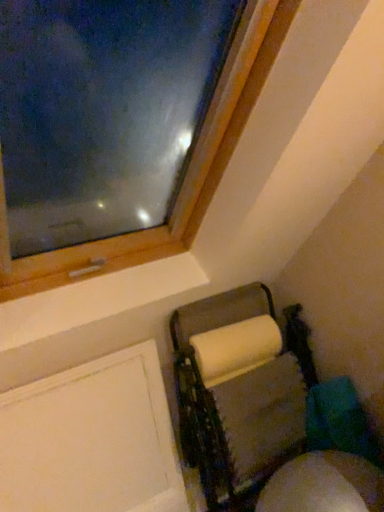
Describe the element at coordinates (256, 396) in the screenshot. The image size is (384, 512). I see `white cardboard paper towel holder at lower right` at that location.

The width and height of the screenshot is (384, 512). What are the coordinates of `white cardboard paper towel holder at lower right` in the screenshot? It's located at (256, 396).

What is the approximate width of white cardboard paper towel holder at lower right?

11.61 inches.

Describe the element at coordinates (92, 440) in the screenshot. The height and width of the screenshot is (512, 384). I see `white matte screen door at lower left` at that location.

Identify the location of white matte screen door at lower left. The height and width of the screenshot is (512, 384). (92, 440).

Find the location of a particular element. white cardboard paper towel holder at lower right is located at coordinates (256, 396).

Looking at this image, between white matte screen door at lower left and white cardboard paper towel holder at lower right, which one appears on the right side from the viewer's perspective?

From the viewer's perspective, white cardboard paper towel holder at lower right appears more on the right side.

Is white matte screen door at lower left further to the viewer compared to white cardboard paper towel holder at lower right?

No, the depth of white matte screen door at lower left is less than that of white cardboard paper towel holder at lower right.

Which is behind, point (73, 424) or point (240, 421)?

The point (240, 421) is more distant.

From the image's perspective, does white matte screen door at lower left appear higher than white cardboard paper towel holder at lower right?

No, from the image's perspective, white matte screen door at lower left is not above white cardboard paper towel holder at lower right.

From a real-world perspective, who is located higher, white matte screen door at lower left or white cardboard paper towel holder at lower right?

white matte screen door at lower left, from a real-world perspective.

Which object is thinner, white matte screen door at lower left or white cardboard paper towel holder at lower right?

white matte screen door at lower left is thinner.

Which of these two, white matte screen door at lower left or white cardboard paper towel holder at lower right, stands shorter?

white matte screen door at lower left.

Is white matte screen door at lower left bigger than white cardboard paper towel holder at lower right?

No.

Is white cardboard paper towel holder at lower right surrounded by white matte screen door at lower left?

No, white cardboard paper towel holder at lower right is not inside white matte screen door at lower left.

Are white matte screen door at lower left and white cardboard paper towel holder at lower right making contact?

No.

Is white matte screen door at lower left facing towards white cardboard paper towel holder at lower right?

No, white matte screen door at lower left is not turned towards white cardboard paper towel holder at lower right.

How different are the orientations of white matte screen door at lower left and white cardboard paper towel holder at lower right in degrees?

The angular difference between white matte screen door at lower left and white cardboard paper towel holder at lower right is 1.97 degrees.

How much distance is there between white matte screen door at lower left and white cardboard paper towel holder at lower right?

38.12 centimeters.

Identify the location of furniture behind the white matte screen door at lower left. The image size is (384, 512). (256, 396).

Considering the positions of objects white cardboard paper towel holder at lower right and white matte screen door at lower left in the image provided, who is more to the right, white cardboard paper towel holder at lower right or white matte screen door at lower left?

From the viewer's perspective, white cardboard paper towel holder at lower right appears more on the right side.

Is white cardboard paper towel holder at lower right positioned before white matte screen door at lower left?

No, white cardboard paper towel holder at lower right is further to the viewer.

Is point (360, 420) closer to camera compared to point (64, 384)?

No.

From the image's perspective, relative to white matte screen door at lower left, is white cardboard paper towel holder at lower right above or below?

A: From the image's perspective, white cardboard paper towel holder at lower right appears above white matte screen door at lower left.

From a real-world perspective, is white cardboard paper towel holder at lower right positioned above or below white matte screen door at lower left?

Clearly, from a real-world perspective, white cardboard paper towel holder at lower right is below white matte screen door at lower left.

Is white cardboard paper towel holder at lower right wider or thinner than white matte screen door at lower left?

white cardboard paper towel holder at lower right is wider than white matte screen door at lower left.

From their relative heights in the image, would you say white cardboard paper towel holder at lower right is taller or shorter than white matte screen door at lower left?

Considering their sizes, white cardboard paper towel holder at lower right has more height than white matte screen door at lower left.

Is white cardboard paper towel holder at lower right bigger than white matte screen door at lower left?

Yes, white cardboard paper towel holder at lower right is bigger than white matte screen door at lower left.

Is white cardboard paper towel holder at lower right outside of white matte screen door at lower left?

Absolutely, white cardboard paper towel holder at lower right is external to white matte screen door at lower left.

Is white cardboard paper towel holder at lower right placed right next to white matte screen door at lower left?

No.

Could you tell me if white cardboard paper towel holder at lower right is turned towards white matte screen door at lower left?

No.

How distant is white cardboard paper towel holder at lower right from white matte screen door at lower left?

A distance of 15.01 inches exists between white cardboard paper towel holder at lower right and white matte screen door at lower left.

Where is `furniture located underneath the white matte screen door at lower left (from a real-world perspective)`? This screenshot has height=512, width=384. furniture located underneath the white matte screen door at lower left (from a real-world perspective) is located at coordinates (256, 396).

What are the coordinates of `screen door that appears below the white cardboard paper towel holder at lower right (from the image's perspective)` in the screenshot? It's located at (92, 440).

Image resolution: width=384 pixels, height=512 pixels. Identify the location of screen door in front of the white cardboard paper towel holder at lower right. pyautogui.click(x=92, y=440).